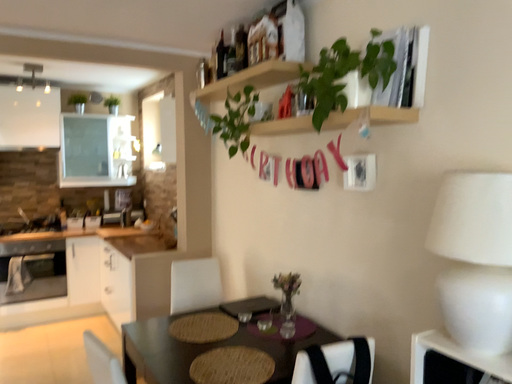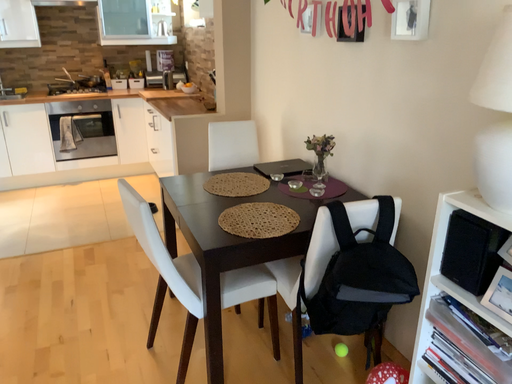
Question: Which way did the camera rotate in the video?

Choices:
 (A) rotated upward
 (B) rotated downward

Answer: (B)